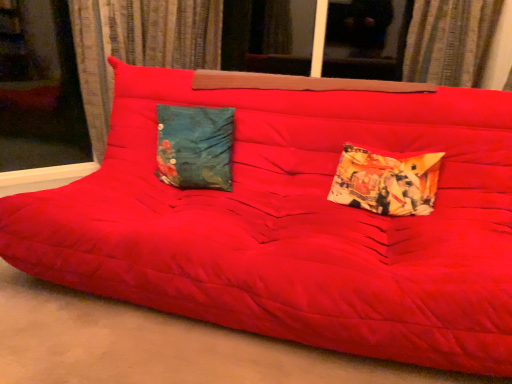
This screenshot has height=384, width=512. I want to click on transparent glass window at upper center, which is the 2th window in left-to-right order, so click(267, 36).

How much space does transparent glass window at upper left, the 1th window when ordered from left to right, occupy horizontally?

transparent glass window at upper left, the 1th window when ordered from left to right, is 5.28 inches in width.

What do you see at coordinates (40, 88) in the screenshot? I see `transparent glass window at upper left, the 1th window when ordered from left to right` at bounding box center [40, 88].

Find the location of a particular element. The height and width of the screenshot is (384, 512). velvet curtain at left, marked as the 1th curtain in a left-to-right arrangement is located at coordinates (138, 46).

Find the location of a particular element. This screenshot has height=384, width=512. textured fabric curtain at upper center, which appears as the second curtain when viewed from the left is located at coordinates (450, 41).

Identify the location of transparent glass window at upper center, which is the 2th window in left-to-right order. The height and width of the screenshot is (384, 512). 267,36.

Is velvet curtain at left, marked as the 1th curtain in a left-to-right arrangement, turned away from transparent glass window at upper left, the 1th window when ordered from left to right?

No.

Which of these two, velvet curtain at left, marked as the 1th curtain in a left-to-right arrangement, or transparent glass window at upper left, which is the second window in right-to-left order, stands taller?

transparent glass window at upper left, which is the second window in right-to-left order, is taller.

Is velvet curtain at left, which appears as the second curtain when viewed from the right, to the left of transparent glass window at upper left, the 1th window when ordered from left to right, from the viewer's perspective?

No, velvet curtain at left, which appears as the second curtain when viewed from the right, is not to the left of transparent glass window at upper left, the 1th window when ordered from left to right.

The height and width of the screenshot is (384, 512). In order to click on the 2nd pillow in front when counting from the velvet curtain at left, marked as the 1th curtain in a left-to-right arrangement in this screenshot , I will do `click(386, 181)`.

From a real-world perspective, is printed fabric pillow at right, positioned as the second pillow in left-to-right order, physically located above or below velvet curtain at left, which appears as the second curtain when viewed from the right?

From a real-world perspective, printed fabric pillow at right, positioned as the second pillow in left-to-right order, is physically below velvet curtain at left, which appears as the second curtain when viewed from the right.

Can you confirm if printed fabric pillow at right, positioned as the second pillow in left-to-right order, is bigger than velvet curtain at left, marked as the 1th curtain in a left-to-right arrangement?

No.

Is point (382, 155) more distant than point (127, 50)?

No.

Identify the location of pillow located in front of the teal fabric pillow at center, acting as the second pillow starting from the right. (386, 181).

Is teal fabric pillow at center, acting as the second pillow starting from the right, oriented towards printed fabric pillow at right, positioned as the second pillow in left-to-right order?

No, teal fabric pillow at center, acting as the second pillow starting from the right, does not turn towards printed fabric pillow at right, positioned as the second pillow in left-to-right order.

From a real-world perspective, is teal fabric pillow at center, acting as the second pillow starting from the right, positioned above or below printed fabric pillow at right, positioned as the second pillow in left-to-right order?

In terms of real-world spatial position, teal fabric pillow at center, acting as the second pillow starting from the right, is above printed fabric pillow at right, positioned as the second pillow in left-to-right order.

Is teal fabric pillow at center, arranged as the first pillow when viewed from the left, next to printed fabric pillow at right, positioned as the 1th pillow in right-to-left order, and touching it?

teal fabric pillow at center, arranged as the first pillow when viewed from the left, and printed fabric pillow at right, positioned as the 1th pillow in right-to-left order, are not in contact.

Choose the correct answer: Is printed fabric pillow at right, positioned as the 1th pillow in right-to-left order, inside transparent glass window at upper center, acting as the first window starting from the right, or outside it?

printed fabric pillow at right, positioned as the 1th pillow in right-to-left order, exists outside the volume of transparent glass window at upper center, acting as the first window starting from the right.

At what (x,y) coordinates should I click in order to perform the action: click on the 2nd window above the printed fabric pillow at right, positioned as the second pillow in left-to-right order (from the image's perspective). Please return your answer as a coordinate pair (x, y). Looking at the image, I should click on (267, 36).

From the image's perspective, would you say printed fabric pillow at right, positioned as the second pillow in left-to-right order, is shown under transparent glass window at upper center, which is the 2th window in left-to-right order?

Correct, printed fabric pillow at right, positioned as the second pillow in left-to-right order, appears lower than transparent glass window at upper center, which is the 2th window in left-to-right order, in the image.

Which object is closer to the camera, printed fabric pillow at right, positioned as the second pillow in left-to-right order, or transparent glass window at upper center, which is the 2th window in left-to-right order?

printed fabric pillow at right, positioned as the second pillow in left-to-right order, is more forward.

Which object is further away from the camera taking this photo, teal fabric pillow at center, acting as the second pillow starting from the right, or transparent glass window at upper center, acting as the first window starting from the right?

transparent glass window at upper center, acting as the first window starting from the right.

In the scene shown: Is teal fabric pillow at center, arranged as the first pillow when viewed from the left, looking in the opposite direction of transparent glass window at upper center, which is the 2th window in left-to-right order?

Yes, transparent glass window at upper center, which is the 2th window in left-to-right order, is at the back of teal fabric pillow at center, arranged as the first pillow when viewed from the left.

Considering the relative positions of teal fabric pillow at center, arranged as the first pillow when viewed from the left, and transparent glass window at upper center, acting as the first window starting from the right, in the image provided, is teal fabric pillow at center, arranged as the first pillow when viewed from the left, to the right of transparent glass window at upper center, acting as the first window starting from the right, from the viewer's perspective?

In fact, teal fabric pillow at center, arranged as the first pillow when viewed from the left, is to the left of transparent glass window at upper center, acting as the first window starting from the right.

How many degrees apart are the facing directions of teal fabric pillow at center, acting as the second pillow starting from the right, and transparent glass window at upper center, acting as the first window starting from the right?

The facing directions of teal fabric pillow at center, acting as the second pillow starting from the right, and transparent glass window at upper center, acting as the first window starting from the right, are 3.16 degrees apart.

Is velvet curtain at left, marked as the 1th curtain in a left-to-right arrangement, in front of or behind textured fabric curtain at upper center, the first curtain positioned from the right, in the image?

Clearly, velvet curtain at left, marked as the 1th curtain in a left-to-right arrangement, is behind textured fabric curtain at upper center, the first curtain positioned from the right.

From a real-world perspective, is velvet curtain at left, marked as the 1th curtain in a left-to-right arrangement, positioned above or below textured fabric curtain at upper center, the first curtain positioned from the right?

In terms of real-world spatial position, velvet curtain at left, marked as the 1th curtain in a left-to-right arrangement, is below textured fabric curtain at upper center, the first curtain positioned from the right.

Which is more to the left, velvet curtain at left, which appears as the second curtain when viewed from the right, or textured fabric curtain at upper center, the first curtain positioned from the right?

velvet curtain at left, which appears as the second curtain when viewed from the right, is more to the left.

How different are the orientations of velvet curtain at left, marked as the 1th curtain in a left-to-right arrangement, and textured fabric curtain at upper center, the first curtain positioned from the right, in degrees?

The facing directions of velvet curtain at left, marked as the 1th curtain in a left-to-right arrangement, and textured fabric curtain at upper center, the first curtain positioned from the right, are 43.9 degrees apart.

Is matte red futon at center next to printed fabric pillow at right, positioned as the second pillow in left-to-right order?

No, matte red futon at center is not making contact with printed fabric pillow at right, positioned as the second pillow in left-to-right order.

Between point (78, 321) and point (419, 172), which one is positioned in front?

The point (78, 321) is in front.

Is matte red futon at center oriented towards printed fabric pillow at right, positioned as the 1th pillow in right-to-left order?

No, matte red futon at center is not oriented towards printed fabric pillow at right, positioned as the 1th pillow in right-to-left order.

Is matte red futon at center wider or thinner than printed fabric pillow at right, positioned as the 1th pillow in right-to-left order?

In the image, matte red futon at center appears to be wider than printed fabric pillow at right, positioned as the 1th pillow in right-to-left order.

Which curtain is the 1st one when counting from the right side of the transparent glass window at upper left, the 1th window when ordered from left to right? Please provide its 2D coordinates.

[(138, 46)]

From a real-world perspective, starting from the velvet curtain at left, marked as the 1th curtain in a left-to-right arrangement, which pillow is the 2nd one below it? Please provide its 2D coordinates.

[(386, 181)]

When comparing their distances from velvet curtain at left, which appears as the second curtain when viewed from the right, does teal fabric pillow at center, acting as the second pillow starting from the right, or transparent glass window at upper center, acting as the first window starting from the right, seem further?

Based on the image, teal fabric pillow at center, acting as the second pillow starting from the right, appears to be further to velvet curtain at left, which appears as the second curtain when viewed from the right.

Estimate the real-world distances between objects in this image. Which object is closer to printed fabric pillow at right, positioned as the 1th pillow in right-to-left order, velvet curtain at left, marked as the 1th curtain in a left-to-right arrangement, or transparent glass window at upper center, acting as the first window starting from the right?

transparent glass window at upper center, acting as the first window starting from the right, is closer to printed fabric pillow at right, positioned as the 1th pillow in right-to-left order.

From the image, which object appears to be farther from printed fabric pillow at right, positioned as the second pillow in left-to-right order, textured fabric curtain at upper center, the first curtain positioned from the right, or teal fabric pillow at center, acting as the second pillow starting from the right?

textured fabric curtain at upper center, the first curtain positioned from the right.

Looking at the image, which one is located further to velvet curtain at left, which appears as the second curtain when viewed from the right, textured fabric curtain at upper center, which appears as the second curtain when viewed from the left, or transparent glass window at upper center, acting as the first window starting from the right?

The object further to velvet curtain at left, which appears as the second curtain when viewed from the right, is textured fabric curtain at upper center, which appears as the second curtain when viewed from the left.

From the image, which object appears to be farther from transparent glass window at upper center, which is the 2th window in left-to-right order, textured fabric curtain at upper center, which appears as the second curtain when viewed from the left, or matte red futon at center?

matte red futon at center.

Based on their spatial positions, is textured fabric curtain at upper center, which appears as the second curtain when viewed from the left, or teal fabric pillow at center, arranged as the first pillow when viewed from the left, closer to velvet curtain at left, which appears as the second curtain when viewed from the right?

teal fabric pillow at center, arranged as the first pillow when viewed from the left, is closer to velvet curtain at left, which appears as the second curtain when viewed from the right.

From the image, which object appears to be farther from transparent glass window at upper center, which is the 2th window in left-to-right order, velvet curtain at left, which appears as the second curtain when viewed from the right, or transparent glass window at upper left, which is the second window in right-to-left order?

Based on the image, transparent glass window at upper left, which is the second window in right-to-left order, appears to be further to transparent glass window at upper center, which is the 2th window in left-to-right order.

Which object lies further to the anchor point printed fabric pillow at right, positioned as the second pillow in left-to-right order, velvet curtain at left, marked as the 1th curtain in a left-to-right arrangement, or textured fabric curtain at upper center, the first curtain positioned from the right?

velvet curtain at left, marked as the 1th curtain in a left-to-right arrangement, is further to printed fabric pillow at right, positioned as the second pillow in left-to-right order.

Locate an element on the screen. This screenshot has height=384, width=512. window between velvet curtain at left, marked as the 1th curtain in a left-to-right arrangement, and textured fabric curtain at upper center, the first curtain positioned from the right is located at coordinates (267, 36).

You are a GUI agent. You are given a task and a screenshot of the screen. Output one action in this format:
    pyautogui.click(x=<x>, y=<y>)
    Task: Click on the concrete situated between velvet curtain at left, which appears as the second curtain when viewed from the right, and textured fabric curtain at upper center, the first curtain positioned from the right, from left to right
    Image resolution: width=512 pixels, height=384 pixels.
    Given the screenshot: What is the action you would take?
    pyautogui.click(x=162, y=346)

The height and width of the screenshot is (384, 512). What are the coordinates of `curtain between transparent glass window at upper left, which is the second window in right-to-left order, and textured fabric curtain at upper center, the first curtain positioned from the right` in the screenshot? It's located at (138, 46).

Locate an element on the screen. pillow between velvet curtain at left, which appears as the second curtain when viewed from the right, and printed fabric pillow at right, positioned as the 1th pillow in right-to-left order is located at coordinates click(195, 147).